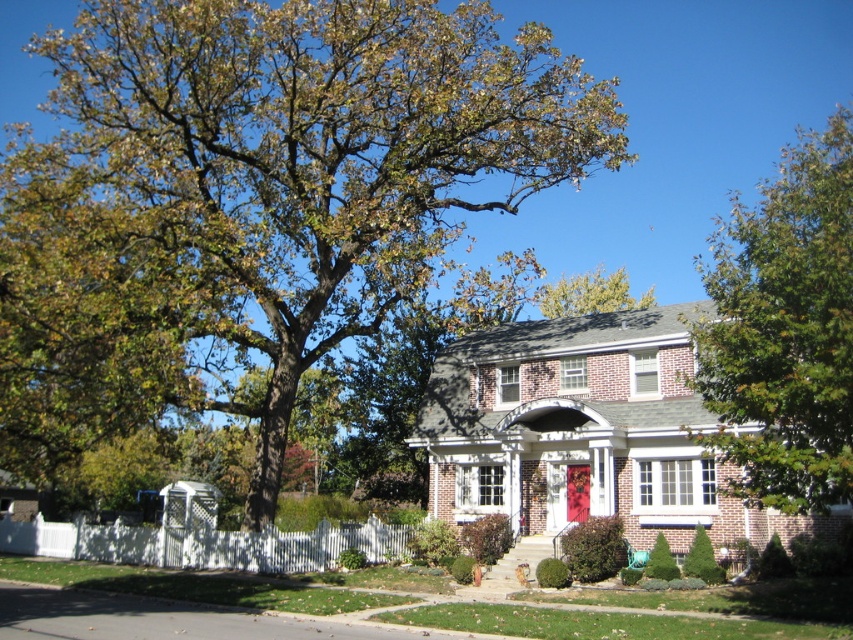
Question: Is green leafy tree at center thinner than red matte door at center?

Choices:
 (A) no
 (B) yes

Answer: (A)

Question: Among these points, which one is nearest to the camera?

Choices:
 (A) (581, 470)
 (B) (109, 237)

Answer: (B)

Question: Does green leafy tree at upper right appear over green leafy tree at upper center?

Choices:
 (A) no
 (B) yes

Answer: (B)

Question: Is green leafy tree at upper right behind green leafy tree at upper center?

Choices:
 (A) no
 (B) yes

Answer: (A)

Question: Which of these objects is positioned closest to the red matte door at center?

Choices:
 (A) green leafy tree at upper center
 (B) green leafy tree at upper right
 (C) green leafy tree at center

Answer: (B)

Question: Among these objects, which one is farthest from the camera?

Choices:
 (A) green leafy tree at upper center
 (B) green leafy tree at center
 (C) green leafy tree at upper right
 (D) red matte door at center

Answer: (A)